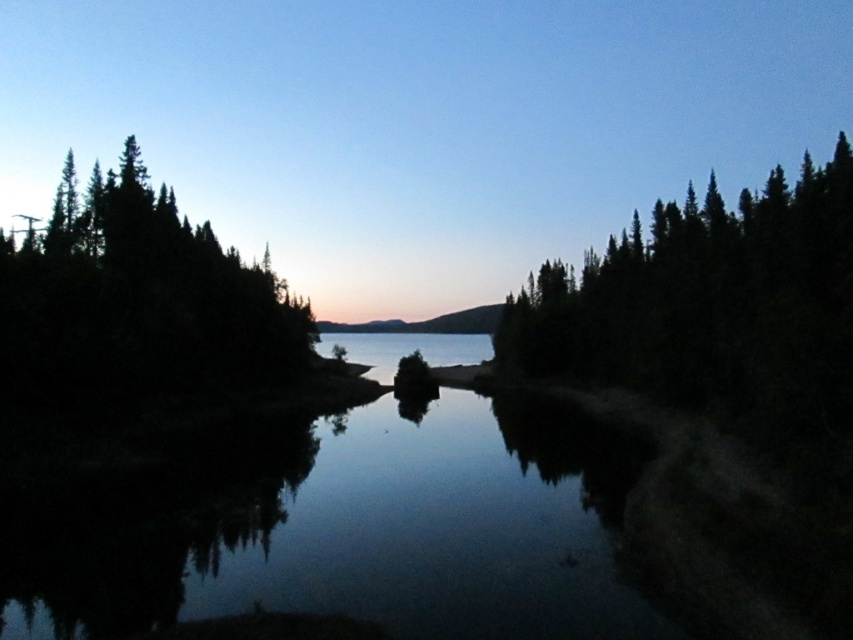
Question: Which object appears farthest from the camera in this image?

Choices:
 (A) dark green textured trees at right
 (B) transparent glass water at center

Answer: (B)

Question: Is dark green textured trees at left below transparent glass water at center?

Choices:
 (A) yes
 (B) no

Answer: (B)

Question: Among these points, which one is nearest to the camera?

Choices:
 (A) (47, 298)
 (B) (347, 356)
 (C) (685, 296)

Answer: (A)

Question: Does dark green textured trees at right appear on the left side of dark green textured trees at left?

Choices:
 (A) yes
 (B) no

Answer: (B)

Question: Is dark green textured trees at right smaller than transparent glass water at center?

Choices:
 (A) yes
 (B) no

Answer: (B)

Question: Which point is farther to the camera?

Choices:
 (A) dark green textured trees at right
 (B) dark green textured trees at left

Answer: (B)